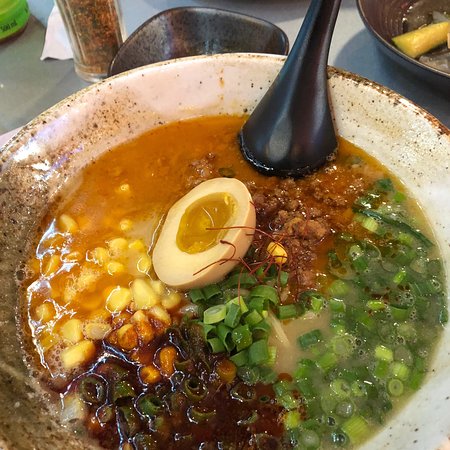
The image size is (450, 450). Identify the location of soup bowl for huge serving. [192, 83].